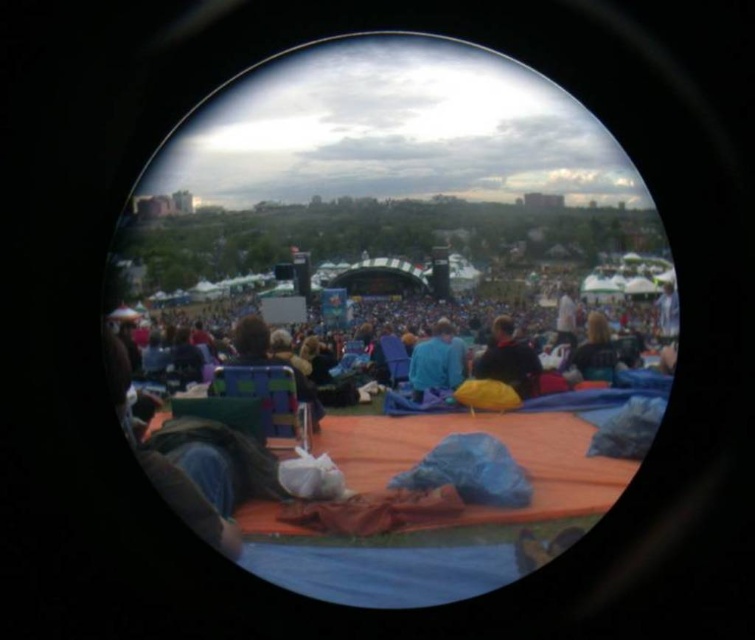
You are a drone operator tasked with capturing aerial footage of the event. Your drone is currently hovering above the stage and needs to fly directly to the dark brown leather jacket at center. However, there is a dark blue fabric at center in the way. Can the drone safely navigate between them without collision?

The distance between dark brown leather jacket at center and dark blue fabric at center is 9.99 meters. Since the drone can safely navigate a gap of at least 10 meters, it should have enough space to pass between them without collision.

You are standing at the center of the crowd and see the dark brown leather jacket at center. If you move 0.1 units to the right in the image, will you be closer to the stage or further away?

The dark brown leather jacket at center is located at point (507, 360). Moving 0.1 units to the right would increase the x coordinate to 0.664. Since the stage is in the front of the image, moving right might not necessarily indicate direction towards or away from the stage. The answer cannot be determined with the given information.

You are standing at the center of the stage area and looking out towards the crowd. There is a blue fabric chair located at point (599, 355). Can you determine whether this chair is positioned to the left or right of the center of the stage area?

The blue fabric chairs at center are located exactly at the center of the stage area, so the chair at point (599, 355) is positioned at the center, not to the left or right.